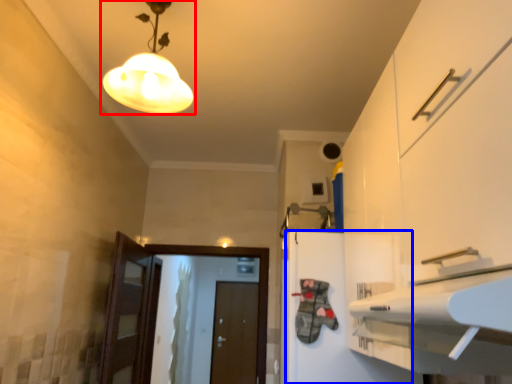
Question: Which object is further to the camera taking this photo, lamp (highlighted by a red box) or cabinetry (highlighted by a blue box)?

Choices:
 (A) lamp
 (B) cabinetry

Answer: (B)